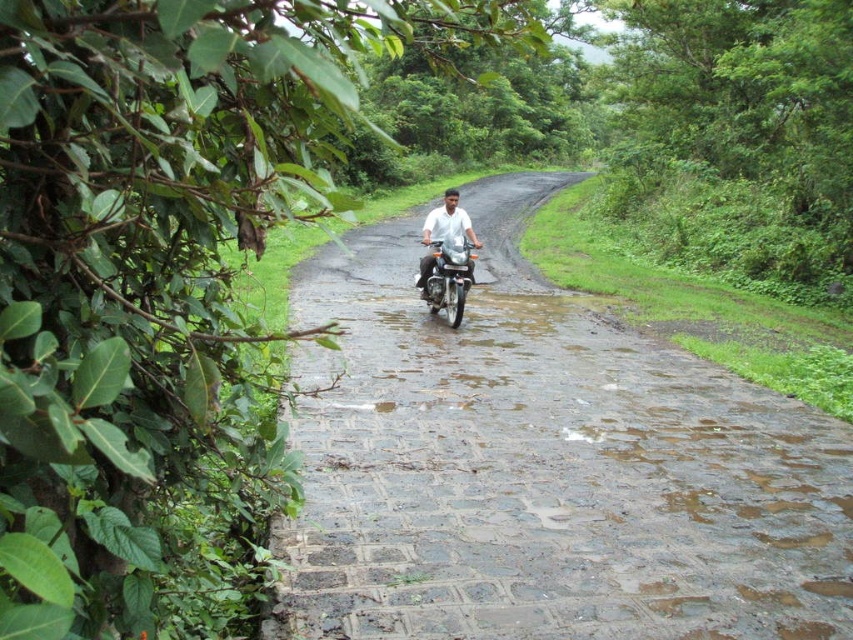
Based on the photo, you are a delivery person riding a metallic silver motorcycle at center. You need to navigate along the paved stone road at center. Is there enough space between the motorcycle and the road to safely maneuver?

The paved stone road at center and metallic silver motorcycle at center are 1.10 meters apart from each other. Since the distance between them is sufficient for safe maneuvering, you can navigate safely.

You are standing at the edge of the road and see two points marked on the road surface. The first point is at coordinates point (564, 404), and the second point is at point (461, 280). Which of these points is closer to your current position?

Point (564, 404) is closer to the viewer than point (461, 280), so the first point is closer to your current position.